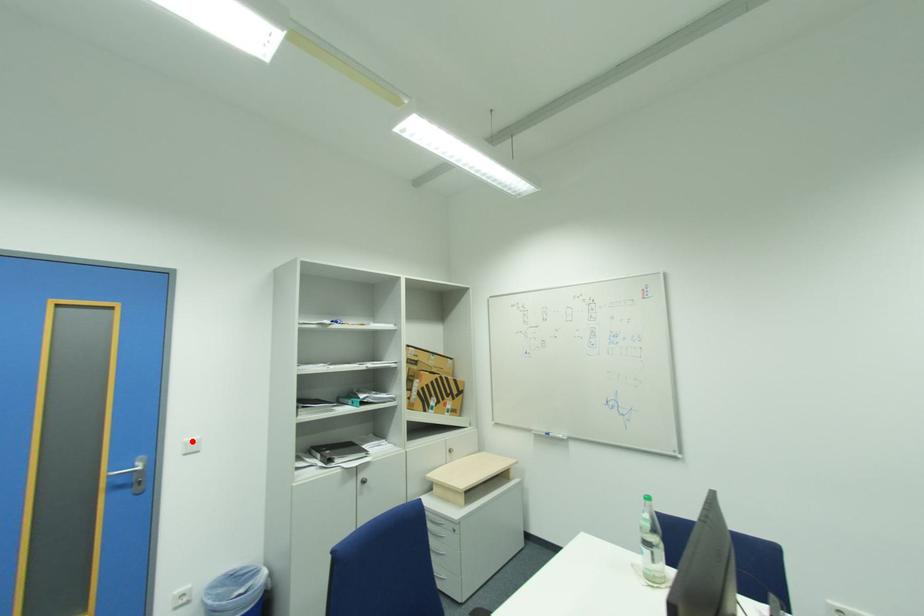
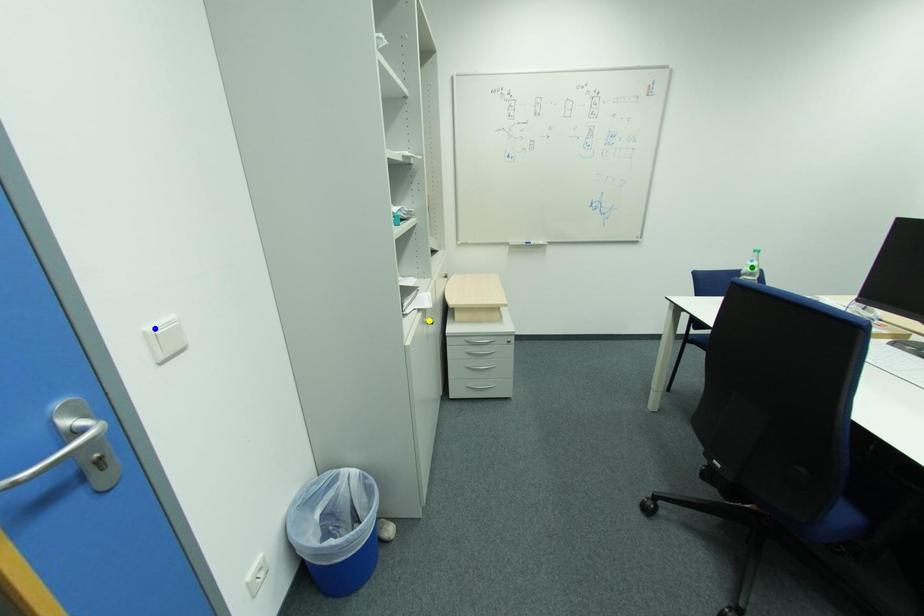
Question: I am providing you with two images of the same scene from different viewpoints. A red point is marked on the first image. You are given multiple points on the second image. Which point in image 2 is actually the same real-world point as the red point in image 1?

Choices:
 (A) green point
 (B) blue point
 (C) yellow point

Answer: (B)